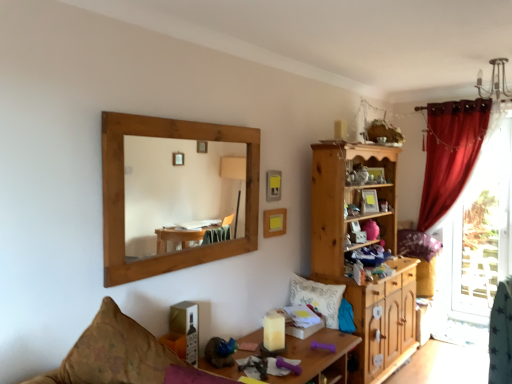
Question: Does point (260, 339) appear closer or farther from the camera than point (264, 215)?

Choices:
 (A) closer
 (B) farther

Answer: (A)

Question: Looking at their shapes, would you say wooden desk at center is wider or thinner than yellow matte picture frame at upper center, placed as the second picture frame when sorted from top to bottom?

Choices:
 (A) thin
 (B) wide

Answer: (B)

Question: Estimate the real-world distances between objects in this image. Which object is farther from the wooden mirror at upper left?

Choices:
 (A) wooden desk at center
 (B) yellow matte picture frame at upper center, which appears as the 1th picture frame when ordered from the bottom
 (C) white textured pillow at center, the first pillow in the front-to-back sequence
 (D) white mesh screen at right
 (E) fluffy purple pillow at right, which is the second pillow from bottom to top

Answer: (D)

Question: Considering the real-world distances, which object is farthest from the fluffy purple pillow at right, the first pillow viewed from the back?

Choices:
 (A) wooden desk at center
 (B) matte yellow picture frame at upper center, which appears as the second picture frame when ordered from the bottom
 (C) white textured pillow at center, placed as the second pillow when sorted from top to bottom
 (D) wooden cabinet at center-right
 (E) wooden mirror at upper left

Answer: (E)